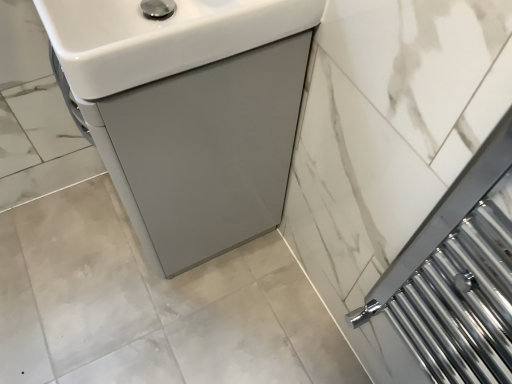
The height and width of the screenshot is (384, 512). What do you see at coordinates (161, 37) in the screenshot? I see `white glossy sink at upper left, arranged as the 1th sink when viewed from the front` at bounding box center [161, 37].

Where is `white glossy sink at upper left, which ranks as the 2th sink in back-to-front order`? This screenshot has width=512, height=384. white glossy sink at upper left, which ranks as the 2th sink in back-to-front order is located at coordinates (161, 37).

The width and height of the screenshot is (512, 384). What do you see at coordinates (189, 112) in the screenshot?
I see `white glossy sink at center, the 2th sink when ordered from front to back` at bounding box center [189, 112].

This screenshot has width=512, height=384. In order to click on white glossy sink at center, the first sink viewed from the back in this screenshot , I will do `click(189, 112)`.

This screenshot has width=512, height=384. What are the coordinates of `white glossy sink at upper left, arranged as the 1th sink when viewed from the front` in the screenshot? It's located at (161, 37).

Which is more to the left, white glossy sink at upper left, which ranks as the 2th sink in back-to-front order, or white glossy sink at center, the 2th sink when ordered from front to back?

From the viewer's perspective, white glossy sink at center, the 2th sink when ordered from front to back, appears more on the left side.

Which object is further away from the camera, white glossy sink at upper left, arranged as the 1th sink when viewed from the front, or white glossy sink at center, the 2th sink when ordered from front to back?

white glossy sink at center, the 2th sink when ordered from front to back, is behind.

Is point (110, 45) closer or farther from the camera than point (211, 3)?

Point (110, 45) is closer to the camera than point (211, 3).

From the image's perspective, would you say white glossy sink at upper left, arranged as the 1th sink when viewed from the front, is positioned over white glossy sink at center, the 2th sink when ordered from front to back?

Yes, from the image's perspective, white glossy sink at upper left, arranged as the 1th sink when viewed from the front, is over white glossy sink at center, the 2th sink when ordered from front to back.

From a real-world perspective, is white glossy sink at upper left, which ranks as the 2th sink in back-to-front order, located higher than white glossy sink at center, the 2th sink when ordered from front to back?

Correct, in the physical world, white glossy sink at upper left, which ranks as the 2th sink in back-to-front order, is higher than white glossy sink at center, the 2th sink when ordered from front to back.

Which object is thinner, white glossy sink at upper left, arranged as the 1th sink when viewed from the front, or white glossy sink at center, the first sink viewed from the back?

white glossy sink at upper left, arranged as the 1th sink when viewed from the front.

Considering the sizes of objects white glossy sink at upper left, arranged as the 1th sink when viewed from the front, and white glossy sink at center, the first sink viewed from the back, in the image provided, who is shorter, white glossy sink at upper left, arranged as the 1th sink when viewed from the front, or white glossy sink at center, the first sink viewed from the back,?

white glossy sink at upper left, arranged as the 1th sink when viewed from the front, is shorter.

Looking at the image, does white glossy sink at upper left, arranged as the 1th sink when viewed from the front, seem bigger or smaller compared to white glossy sink at center, the first sink viewed from the back?

In the image, white glossy sink at upper left, arranged as the 1th sink when viewed from the front, appears to be smaller than white glossy sink at center, the first sink viewed from the back.

Is white glossy sink at center, the 2th sink when ordered from front to back, a part of white glossy sink at upper left, which ranks as the 2th sink in back-to-front order?

No, white glossy sink at center, the 2th sink when ordered from front to back, is not a part of white glossy sink at upper left, which ranks as the 2th sink in back-to-front order.

Is white glossy sink at upper left, which ranks as the 2th sink in back-to-front order, beside white glossy sink at center, the 2th sink when ordered from front to back?

There is a gap between white glossy sink at upper left, which ranks as the 2th sink in back-to-front order, and white glossy sink at center, the 2th sink when ordered from front to back.

Is white glossy sink at upper left, which ranks as the 2th sink in back-to-front order, aimed at white glossy sink at center, the first sink viewed from the back?

No, white glossy sink at upper left, which ranks as the 2th sink in back-to-front order, is not turned towards white glossy sink at center, the first sink viewed from the back.

You are a GUI agent. You are given a task and a screenshot of the screen. Output one action in this format:
    pyautogui.click(x=<x>, y=<y>)
    Task: Click on the sink on the left of white glossy sink at upper left, which ranks as the 2th sink in back-to-front order
    
    Given the screenshot: What is the action you would take?
    pyautogui.click(x=189, y=112)

In the image, is white glossy sink at center, the first sink viewed from the back, on the left side or the right side of white glossy sink at upper left, arranged as the 1th sink when viewed from the front?

white glossy sink at center, the first sink viewed from the back, is to the left of white glossy sink at upper left, arranged as the 1th sink when viewed from the front.

Is white glossy sink at center, the 2th sink when ordered from front to back, behind white glossy sink at upper left, arranged as the 1th sink when viewed from the front?

That is True.

Is point (217, 193) in front of point (93, 0)?

No, (217, 193) is further to viewer.

From the image's perspective, is white glossy sink at center, the first sink viewed from the back, below white glossy sink at upper left, which ranks as the 2th sink in back-to-front order?

Yes.

From a real-world perspective, is white glossy sink at center, the 2th sink when ordered from front to back, on white glossy sink at upper left, which ranks as the 2th sink in back-to-front order?

No, from a real-world perspective, white glossy sink at center, the 2th sink when ordered from front to back, is not on top of white glossy sink at upper left, which ranks as the 2th sink in back-to-front order.

Considering the sizes of white glossy sink at center, the first sink viewed from the back, and white glossy sink at upper left, arranged as the 1th sink when viewed from the front, in the image, is white glossy sink at center, the first sink viewed from the back, wider or thinner than white glossy sink at upper left, arranged as the 1th sink when viewed from the front,?

white glossy sink at center, the first sink viewed from the back, is wider than white glossy sink at upper left, arranged as the 1th sink when viewed from the front.

Is white glossy sink at center, the 2th sink when ordered from front to back, taller or shorter than white glossy sink at upper left, arranged as the 1th sink when viewed from the front?

In the image, white glossy sink at center, the 2th sink when ordered from front to back, appears to be taller than white glossy sink at upper left, arranged as the 1th sink when viewed from the front.

Is white glossy sink at center, the 2th sink when ordered from front to back, bigger than white glossy sink at upper left, which ranks as the 2th sink in back-to-front order?

Yes, white glossy sink at center, the 2th sink when ordered from front to back, is bigger than white glossy sink at upper left, which ranks as the 2th sink in back-to-front order.

Does white glossy sink at center, the 2th sink when ordered from front to back, contain white glossy sink at upper left, which ranks as the 2th sink in back-to-front order?

No, white glossy sink at upper left, which ranks as the 2th sink in back-to-front order, is not inside white glossy sink at center, the 2th sink when ordered from front to back.

In the scene shown: Is white glossy sink at center, the first sink viewed from the back, beside white glossy sink at upper left, which ranks as the 2th sink in back-to-front order?

No, white glossy sink at center, the first sink viewed from the back, is not in contact with white glossy sink at upper left, which ranks as the 2th sink in back-to-front order.

Is white glossy sink at center, the first sink viewed from the back, aimed at white glossy sink at upper left, arranged as the 1th sink when viewed from the front?

No.

How many degrees apart are the facing directions of white glossy sink at center, the 2th sink when ordered from front to back, and white glossy sink at upper left, which ranks as the 2th sink in back-to-front order?

They differ by 0.769 degrees in their facing directions.

Where is `sink on the left side of white glossy sink at upper left, arranged as the 1th sink when viewed from the front`? The width and height of the screenshot is (512, 384). sink on the left side of white glossy sink at upper left, arranged as the 1th sink when viewed from the front is located at coordinates (189, 112).

Locate an element on the screen. This screenshot has width=512, height=384. sink above the white glossy sink at center, the 2th sink when ordered from front to back (from the image's perspective) is located at coordinates (161, 37).

Find the location of `sink on the left of white glossy sink at upper left, which ranks as the 2th sink in back-to-front order`. sink on the left of white glossy sink at upper left, which ranks as the 2th sink in back-to-front order is located at coordinates (189, 112).